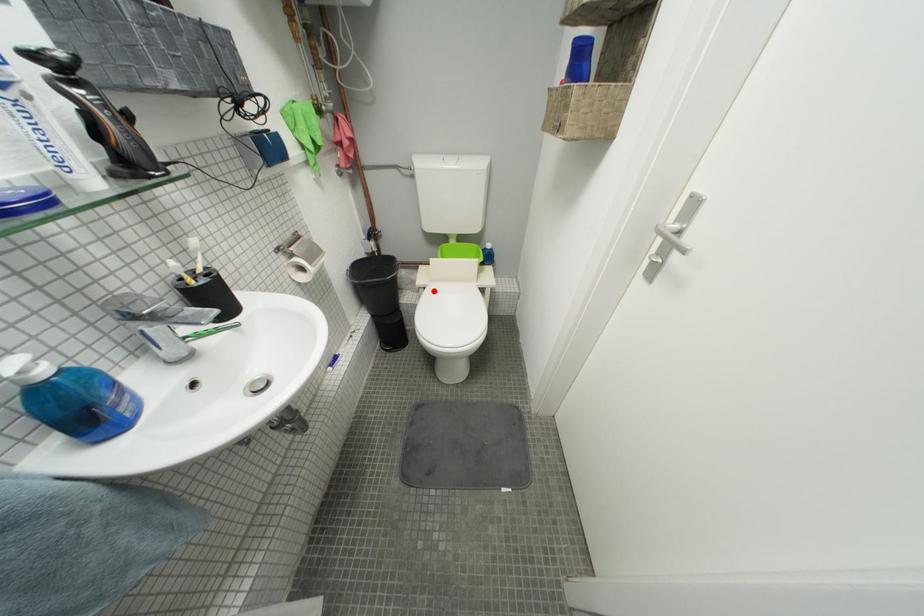
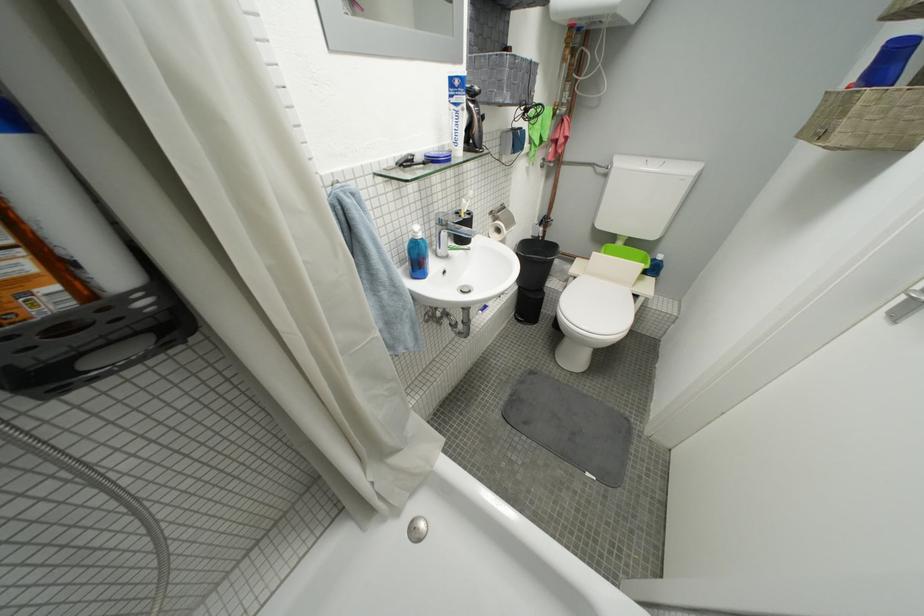
In the second image, find the point that corresponds to the highlighted location in the first image.

(584, 281)